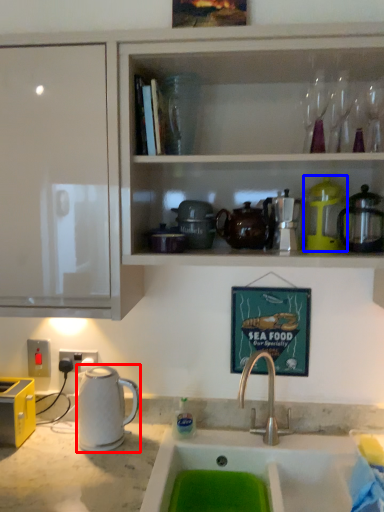
Question: Which object appears closest to the camera in this image, kitchen appliance (highlighted by a red box) or appliance (highlighted by a blue box)?

Choices:
 (A) kitchen appliance
 (B) appliance

Answer: (B)